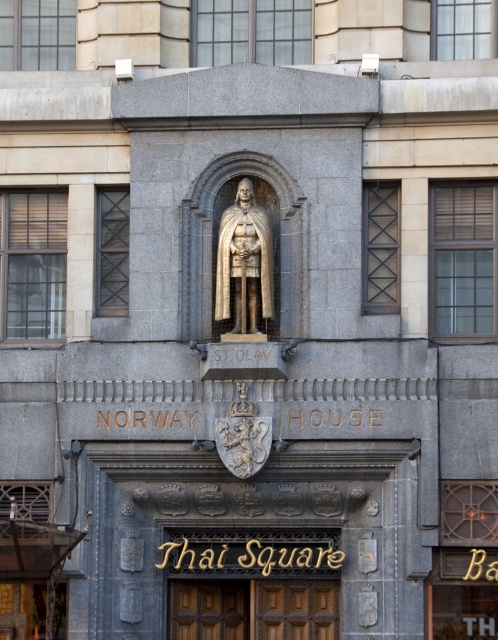
In the scene shown: Does gold wood sign at center have a lesser height compared to gold polished statue at center?

Indeed, gold wood sign at center has a lesser height compared to gold polished statue at center.

Does gold wood sign at center have a smaller size compared to gold polished statue at center?

Yes.

The width and height of the screenshot is (498, 640). In order to click on gold wood sign at center in this screenshot , I will do `click(251, 584)`.